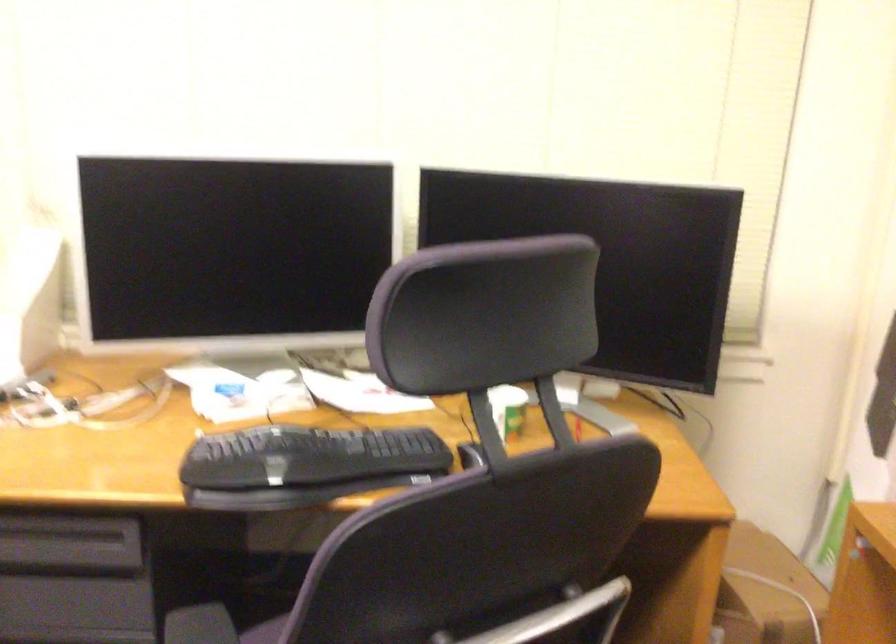
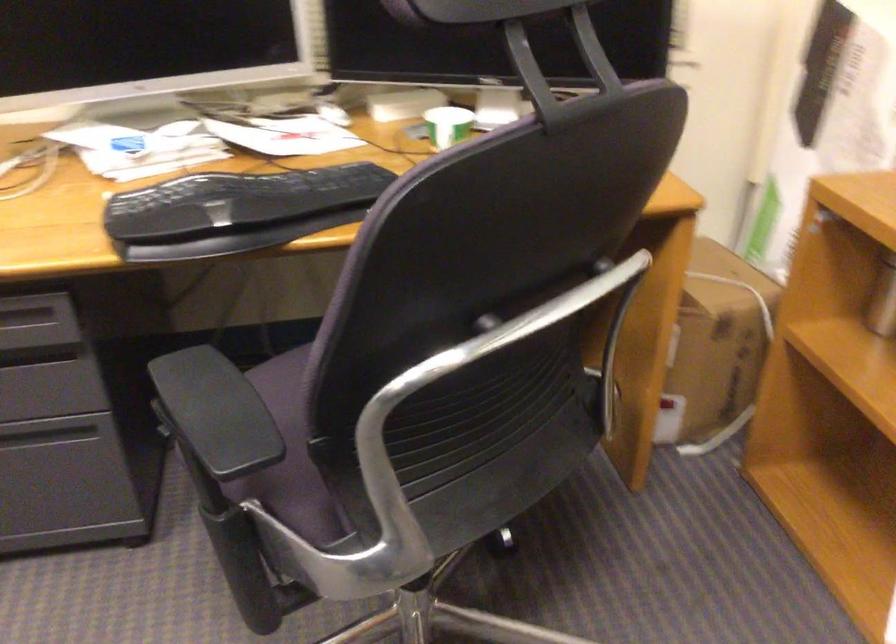
Question: The images are taken continuously from a first-person perspective. In which direction is your viewpoint rotating?

Choices:
 (A) Left
 (B) Right
 (C) Up
 (D) Down

Answer: (D)